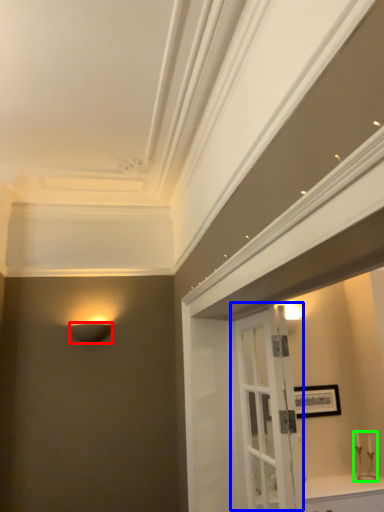
Question: Based on their relative distances, which object is nearer to lamp (highlighted by a red box)? Choose from door (highlighted by a blue box) and candle holder (highlighted by a green box).

Choices:
 (A) door
 (B) candle holder

Answer: (A)